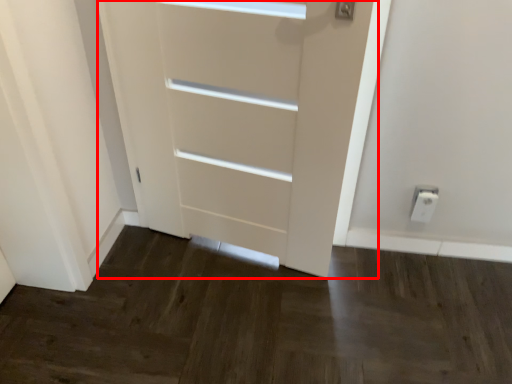
Question: From the image's perspective, what is the correct spatial positioning of door (annotated by the red box) in reference to electric outlet?

Choices:
 (A) above
 (B) below

Answer: (A)